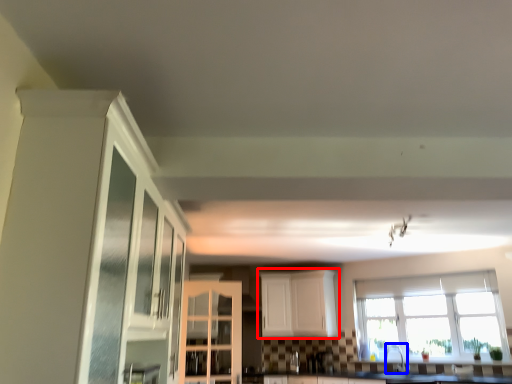
Question: Which object appears closest to the camera in this image, cabinetry (highlighted by a red box) or faucet (highlighted by a blue box)?

Choices:
 (A) cabinetry
 (B) faucet

Answer: (B)